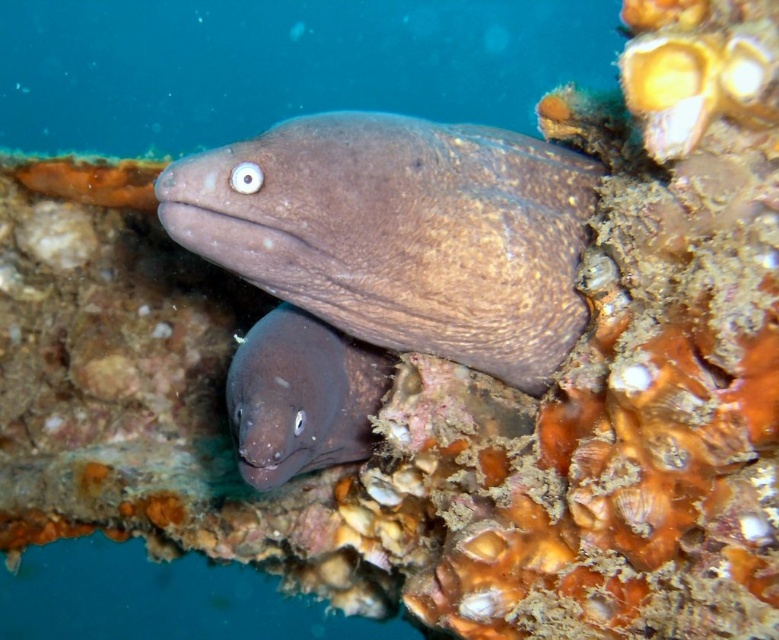
Between brown matte moray at center and smooth brown eel at center, which one appears on the right side from the viewer's perspective?

Positioned to the right is brown matte moray at center.

Looking at this image, is brown matte moray at center taller than smooth brown eel at center?

Yes.

This screenshot has width=779, height=640. I want to click on brown matte moray at center, so click(400, 232).